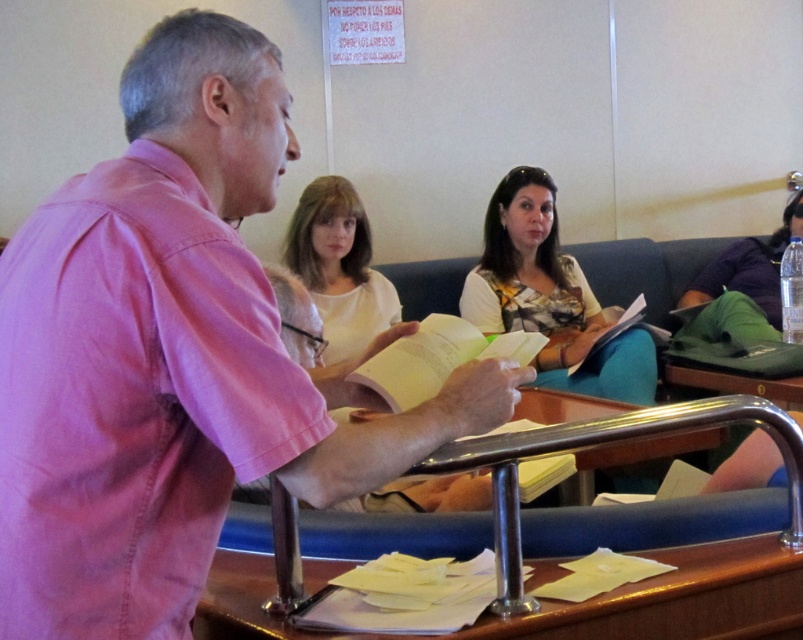
You are standing in the public meeting room and want to reach the point marked at coordinates point (618,369). If you can walk 1.5 meters in 1 second, how long will it take you to reach that point?

The distance between you and the point (618,369) is 3.23 meters. At a walking speed of 1.5 meters per second, it would take approximately 2.15 seconds to reach the point.

You are standing in the meeting room and want to take a photo of both the speaker and the audience. The speaker is at point (x=659, y=516) and the audience member with the green bag is at point (x=552, y=300). Which point should you focus on first to ensure both are in focus?

You should focus on point (x=552, y=300) first because it is farther from the camera than point (x=659, y=516). By focusing on the farther point, the closer point will also be within the depth of field, ensuring both are in focus.

You are organizing a photo shoot and need to arrange two models wearing the printed fabric blouse at center and white matte shirt at center. Based on the scene description, which clothing item should be placed higher to match their positions in the original image?

The printed fabric blouse at center should be placed higher since it is much taller than the white matte shirt at center in the original image.